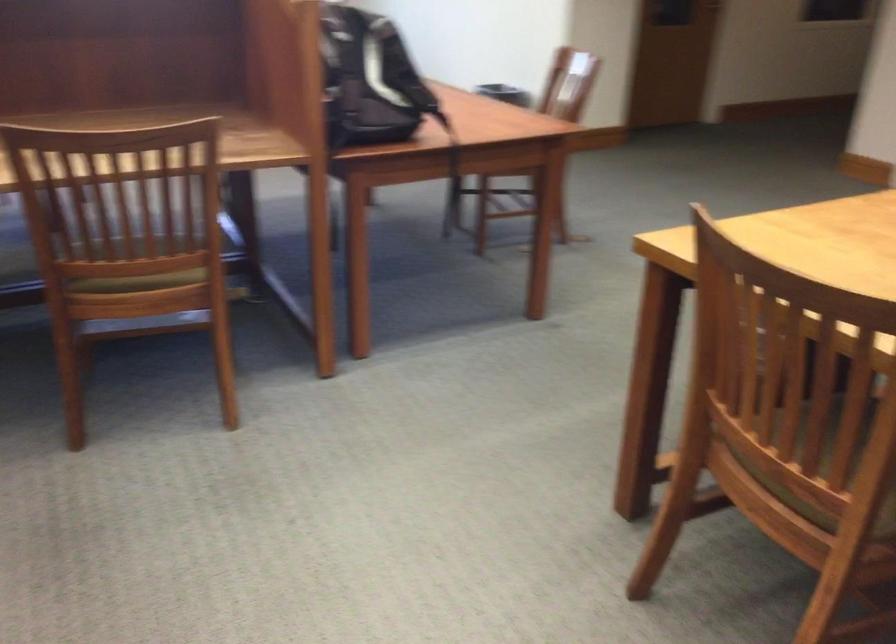
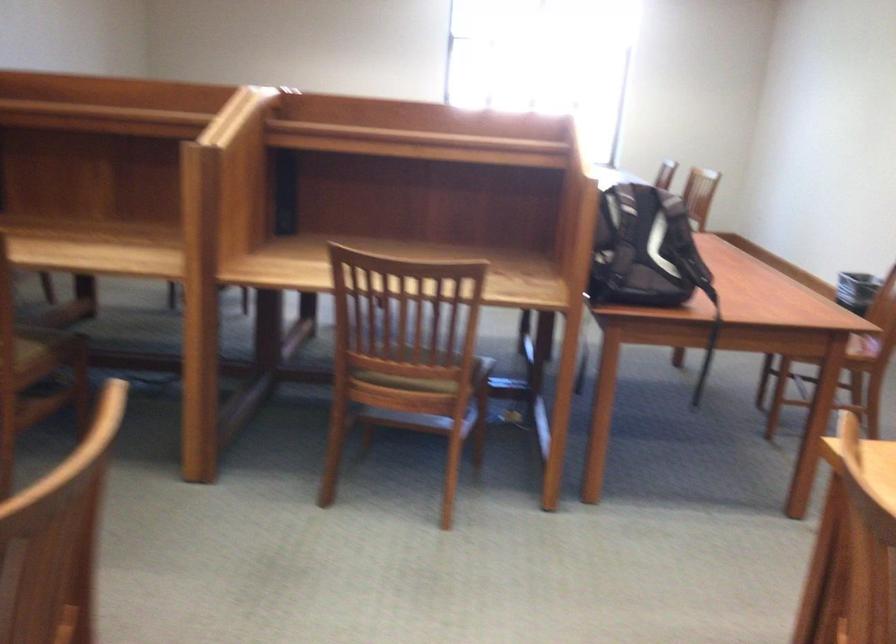
Where in the second image is the point corresponding to (x=165, y=272) from the first image?

(421, 379)